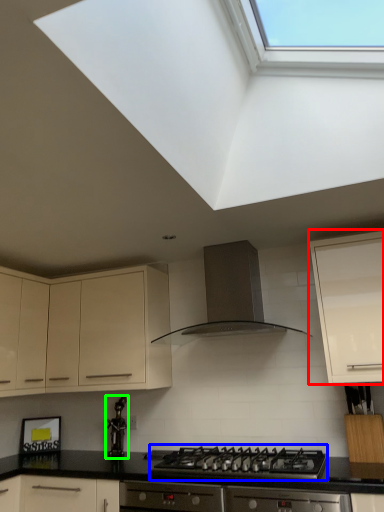
Question: Estimate the real-world distances between objects in this image. Which object is closer to cabinetry (highlighted by a red box), gas stove (highlighted by a blue box) or appliance (highlighted by a green box)?

Choices:
 (A) gas stove
 (B) appliance

Answer: (A)